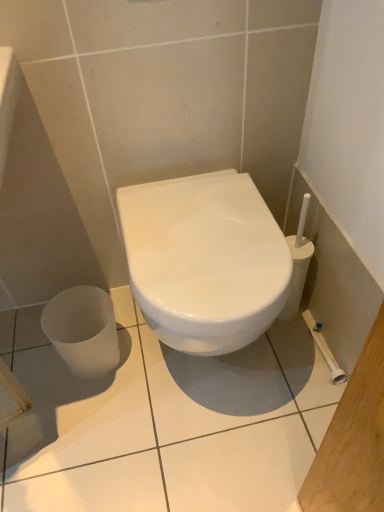
Question: Is white glossy toilet at center in front of or behind white glossy ceramic tile at center in the image?

Choices:
 (A) behind
 (B) front

Answer: (B)

Question: From the image's perspective, relative to white glossy ceramic tile at center, is white glossy toilet at center above or below?

Choices:
 (A) below
 (B) above

Answer: (B)

Question: Considering the relative positions of white glossy toilet at center and white glossy ceramic tile at center in the image provided, is white glossy toilet at center to the left or to the right of white glossy ceramic tile at center?

Choices:
 (A) right
 (B) left

Answer: (A)

Question: From the image's perspective, is white glossy ceramic tile at center located above or below white glossy toilet at center?

Choices:
 (A) above
 (B) below

Answer: (B)

Question: In the image, is white glossy ceramic tile at center positioned in front of or behind white glossy toilet at center?

Choices:
 (A) behind
 (B) front

Answer: (A)

Question: Is white glossy ceramic tile at center taller or shorter than white glossy toilet at center?

Choices:
 (A) short
 (B) tall

Answer: (A)

Question: In terms of size, does white glossy ceramic tile at center appear bigger or smaller than white glossy toilet at center?

Choices:
 (A) big
 (B) small

Answer: (B)